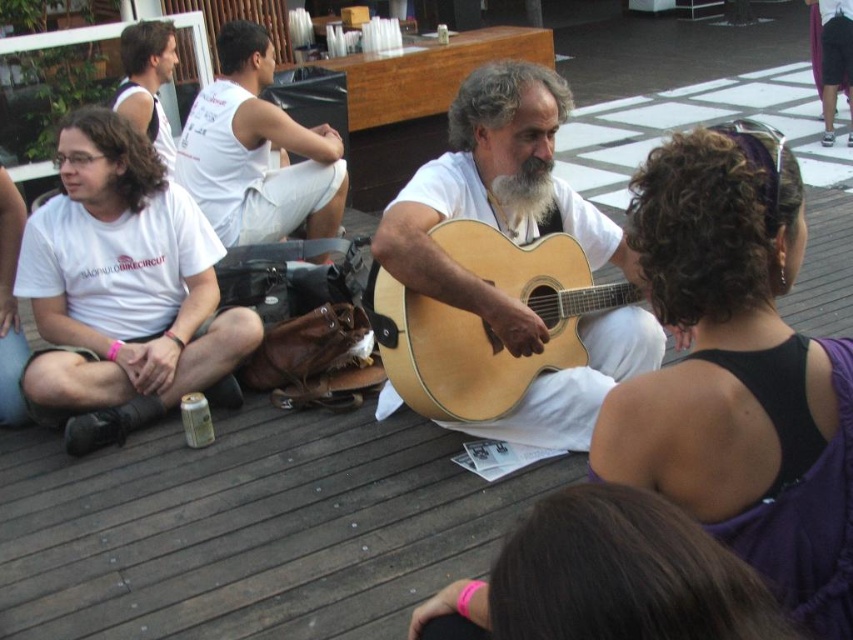
Question: Can you confirm if white cotton t-shirt at left is wider than white cotton shirt at upper left?

Choices:
 (A) no
 (B) yes

Answer: (B)

Question: Estimate the real-world distances between objects in this image. Which object is closer to the white cotton shirt at upper left?

Choices:
 (A) white matte beard at center
 (B) white cotton tank top at upper left
 (C) white cotton t-shirt at left
 (D) natural wood acoustic guitar at center

Answer: (B)

Question: Is white cotton tank top at upper left above white matte beard at center?

Choices:
 (A) no
 (B) yes

Answer: (B)

Question: Is white cotton t-shirt at left further to camera compared to white cotton tank top at upper left?

Choices:
 (A) yes
 (B) no

Answer: (B)

Question: Which point is closer to the camera?

Choices:
 (A) (283, 141)
 (B) (128, 61)

Answer: (A)

Question: Considering the real-world distances, which object is farthest from the white matte beard at center?

Choices:
 (A) white cotton t-shirt at left
 (B) white cotton tank top at upper left
 (C) natural wood acoustic guitar at center

Answer: (B)